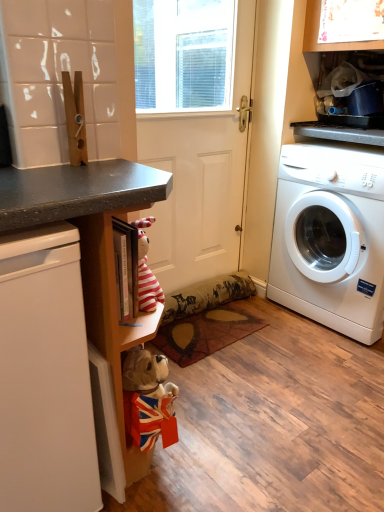
You are a GUI agent. You are given a task and a screenshot of the screen. Output one action in this format:
    pyautogui.click(x=<x>, y=<y>)
    Task: Click on the vacant area in front of white plastic washing machine at right
    Image resolution: width=384 pixels, height=512 pixels.
    Given the screenshot: What is the action you would take?
    pyautogui.click(x=320, y=368)